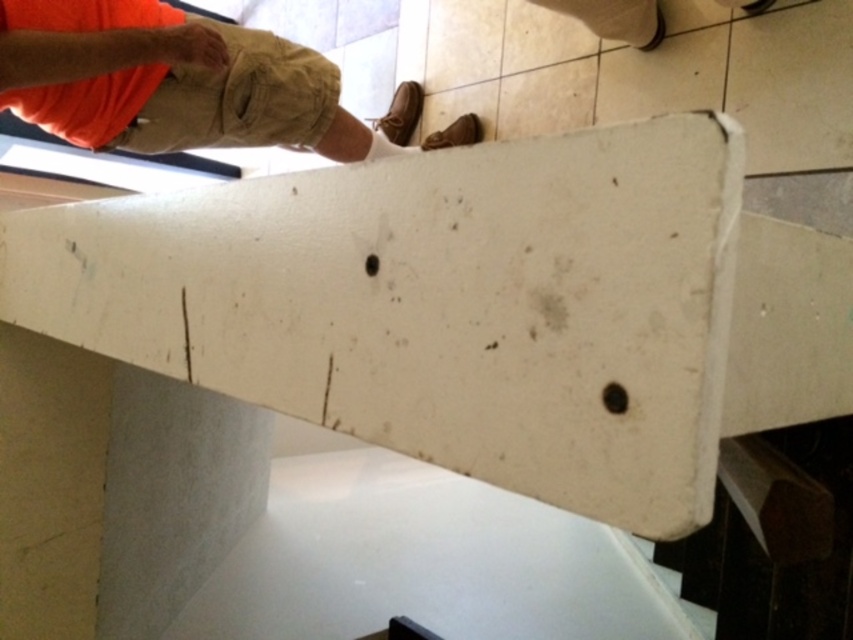
You are a fashion designer observing the image. You notice the orange cotton shirt at upper left and the matte orange hand at upper left. Which object is closer to you in the scene?

The orange cotton shirt at upper left is in front of the matte orange hand at upper left, so the orange cotton shirt at upper left is closer to you.

You are a photographer setting up a shoot in the scene described. You need to position a light source to the right of both the orange cotton shirt at upper left and the matte orange hand at upper left. Is this possible given their positions?

The orange cotton shirt at upper left is to the left of the matte orange hand at upper left, so placing a light source to the right of both would be possible as they are arranged from left to right with the shirt first, then the hand. The light can be positioned to the right of the hand.

In the scene shown: You are a worker inspecting the white matte plank at upper center and the matte orange hand at upper left. Which object is positioned lower in the scene?

The white matte plank at upper center is located below the matte orange hand at upper left, so the white matte plank at upper center is positioned lower in the scene.